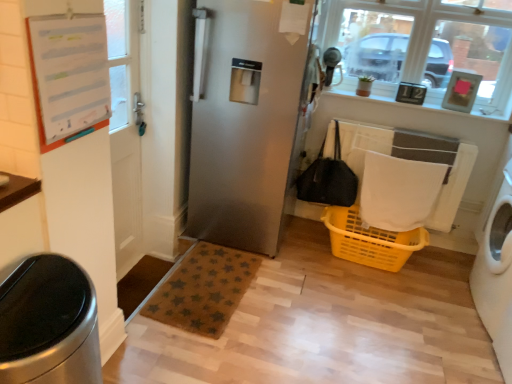
What is the approximate height of yellow plastic laundry basket at lower center?

yellow plastic laundry basket at lower center is 27.78 centimeters tall.

Measure the distance between white plastic washing machine at right and camera.

They are 1.80 meters apart.

The height and width of the screenshot is (384, 512). What do you see at coordinates (497, 275) in the screenshot?
I see `white plastic washing machine at right` at bounding box center [497, 275].

This screenshot has height=384, width=512. I want to click on brown textured mat at lower left, so click(140, 282).

The image size is (512, 384). I want to click on white textured towel at right, so click(398, 191).

In terms of width, does white textured towel at right look wider or thinner when compared to brushed metal trash can at lower left?

white textured towel at right is thinner than brushed metal trash can at lower left.

From the image's perspective, between white textured towel at right and brushed metal trash can at lower left, which one is located above?

white textured towel at right appears higher in the image.

From the picture: Which point is more forward, (414, 227) or (53, 368)?

The point (53, 368) is closer.

Is white textured towel at right further to the viewer compared to brushed metal trash can at lower left?

Yes, the depth of white textured towel at right is greater than that of brushed metal trash can at lower left.

Is brown textured mat at lower center behind brushed metal trash can at lower left?

Yes, brown textured mat at lower center is behind brushed metal trash can at lower left.

Is brown textured mat at lower center looking in the opposite direction of brushed metal trash can at lower left?

brown textured mat at lower center does not have its back to brushed metal trash can at lower left.

Is brown textured mat at lower center wider or thinner than brushed metal trash can at lower left?

brown textured mat at lower center is wider than brushed metal trash can at lower left.

Where is `waste container on the left of brown textured mat at lower center`? This screenshot has width=512, height=384. waste container on the left of brown textured mat at lower center is located at coordinates (49, 323).

Measure the distance from black fabric bag at center to brown textured mat at lower left.

They are 3.83 feet apart.

Does black fabric bag at center appear on the left side of brown textured mat at lower left?

In fact, black fabric bag at center is to the right of brown textured mat at lower left.

From a real-world perspective, which is physically below, black fabric bag at center or brown textured mat at lower left?

From a 3D spatial view, brown textured mat at lower left is below.

Is black fabric bag at center not close to brown textured mat at lower left?

Yes, black fabric bag at center is far from brown textured mat at lower left.

From a real-world perspective, is brushed metal trash can at lower left on white paper at upper left?

No, from a real-world perspective, brushed metal trash can at lower left is not on top of white paper at upper left.

Is brushed metal trash can at lower left in front of white paper at upper left?

Yes, brushed metal trash can at lower left is closer to the viewer.

Identify the location of waste container in front of the white paper at upper left. (49, 323).

Which point is more distant from viewer, [10,295] or [103,81]?

The point [103,81] is farther from the camera.

Looking at their sizes, would you say brushed metal trash can at lower left is wider or thinner than brown textured mat at lower center?

Considering their sizes, brushed metal trash can at lower left looks slimmer than brown textured mat at lower center.

Would you say brushed metal trash can at lower left contains brown textured mat at lower center?

No, brushed metal trash can at lower left does not contain brown textured mat at lower center.

What's the angular difference between brushed metal trash can at lower left and brown textured mat at lower center's facing directions?

7.9 degrees.

The width and height of the screenshot is (512, 384). In the image, there is a brown textured mat at lower center. Find the location of `waste container below it (from the image's perspective)`. waste container below it (from the image's perspective) is located at coordinates (49, 323).

Image resolution: width=512 pixels, height=384 pixels. What are the coordinates of `basket below the clear glass window at upper right (from the image's perspective)` in the screenshot? It's located at (370, 240).

Is clear glass window at upper right inside yellow plastic laundry basket at lower center?

That's incorrect, clear glass window at upper right is not inside yellow plastic laundry basket at lower center.

How many degrees apart are the facing directions of yellow plastic laundry basket at lower center and clear glass window at upper right?

3.14 degrees separate the facing orientations of yellow plastic laundry basket at lower center and clear glass window at upper right.

Are yellow plastic laundry basket at lower center and clear glass window at upper right located far from each other?

Yes, yellow plastic laundry basket at lower center and clear glass window at upper right are quite far apart.

The height and width of the screenshot is (384, 512). In order to click on blanket that is above the brown textured mat at lower center (from the image's perspective) in this screenshot , I will do `click(398, 191)`.

From a real-world perspective, who is located higher, brown textured mat at lower center or white textured towel at right?

white textured towel at right, from a real-world perspective.

Considering the relative sizes of brown textured mat at lower center and white textured towel at right in the image provided, is brown textured mat at lower center bigger than white textured towel at right?

No.

From the image's perspective, is brown textured mat at lower center above or below white textured towel at right?

brown textured mat at lower center is below white textured towel at right.

You are a GUI agent. You are given a task and a screenshot of the screen. Output one action in this format:
    pyautogui.click(x=<x>, y=<y>)
    Task: Click on the blanket located above the brushed metal trash can at lower left (from the image's perspective)
    
    Given the screenshot: What is the action you would take?
    pyautogui.click(x=398, y=191)

The width and height of the screenshot is (512, 384). What are the coordinates of `waste container below the brown textured mat at lower center (from the image's perspective)` in the screenshot? It's located at (49, 323).

Based on their spatial positions, is white paper at upper left or yellow plastic laundry basket at lower center further from white textured towel at right?

Based on the image, white paper at upper left appears to be further to white textured towel at right.

Looking at the image, which one is located further to black fabric bag at center, brown textured mat at lower center or clear glass window at upper right?

brown textured mat at lower center lies further to black fabric bag at center than the other object.

When comparing their distances from white textured towel at right, does black fabric bag at center or white plastic washing machine at right seem closer?

black fabric bag at center lies closer to white textured towel at right than the other object.

When comparing their distances from brushed metal trash can at lower left, does white textured towel at right or brown textured mat at lower left seem further?

Among the two, white textured towel at right is located further to brushed metal trash can at lower left.

Based on their spatial positions, is black fabric bag at center or brown textured mat at lower left closer to clear glass window at upper right?

Based on the image, black fabric bag at center appears to be nearer to clear glass window at upper right.

Looking at the image, which one is located further to brown textured mat at lower center, clear glass window at upper right or yellow plastic laundry basket at lower center?

clear glass window at upper right lies further to brown textured mat at lower center than the other object.

When comparing their distances from brown textured mat at lower center, does yellow plastic laundry basket at lower center or white plastic washing machine at right seem closer?

yellow plastic laundry basket at lower center is closer to brown textured mat at lower center.

Based on their spatial positions, is brushed metal trash can at lower left or brown textured mat at lower center further from white paper at upper left?

brown textured mat at lower center is positioned further to the anchor white paper at upper left.

This screenshot has width=512, height=384. What are the coordinates of `washing machine between clear glass window at upper right and yellow plastic laundry basket at lower center from top to bottom` in the screenshot? It's located at (497, 275).

The width and height of the screenshot is (512, 384). I want to click on plain located between brown textured mat at lower left and clear glass window at upper right in the left-right direction, so click(203, 289).

The image size is (512, 384). I want to click on basket between white paper at upper left and clear glass window at upper right in the horizontal direction, so click(x=370, y=240).

The image size is (512, 384). What are the coordinates of `plain between brown textured mat at lower left and black fabric bag at center` in the screenshot? It's located at (203, 289).